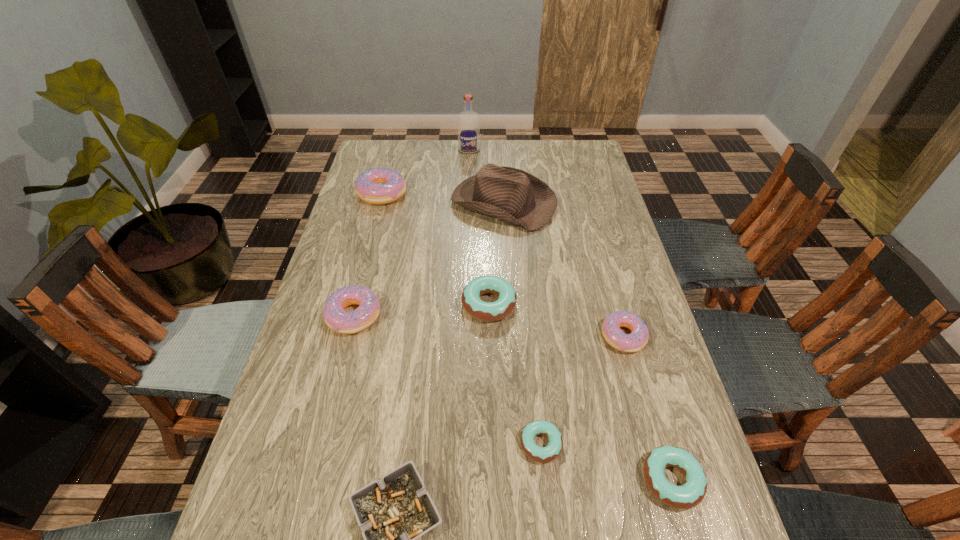
Locate an element on the screen. the farthest object is located at coordinates (468, 121).

Find the location of a particular element. The height and width of the screenshot is (540, 960). the tallest object is located at coordinates (468, 121).

Where is `the eighth shortest object`? the eighth shortest object is located at coordinates (513, 196).

Image resolution: width=960 pixels, height=540 pixels. Find the location of `the tallest doughnut`. the tallest doughnut is located at coordinates (378, 186).

Find the location of `the farthest doughnut`. the farthest doughnut is located at coordinates (378, 186).

Where is `the second smallest pink doughnut`? the second smallest pink doughnut is located at coordinates (336, 318).

Locate an element on the screen. Image resolution: width=960 pixels, height=540 pixels. the fourth tallest object is located at coordinates (336, 318).

In order to click on the biggest blue doughnut in this screenshot , I will do `click(484, 311)`.

Image resolution: width=960 pixels, height=540 pixels. In order to click on the rightmost pink doughnut in this screenshot , I will do `click(614, 336)`.

Find the location of a particular element. the second shortest doughnut is located at coordinates (690, 494).